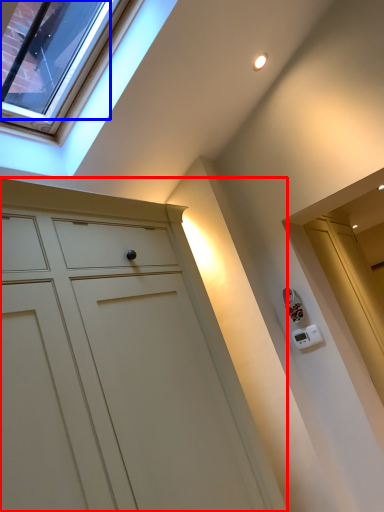
Question: Which object appears farthest to the camera in this image, cupboard (highlighted by a red box) or glass door (highlighted by a blue box)?

Choices:
 (A) cupboard
 (B) glass door

Answer: (B)